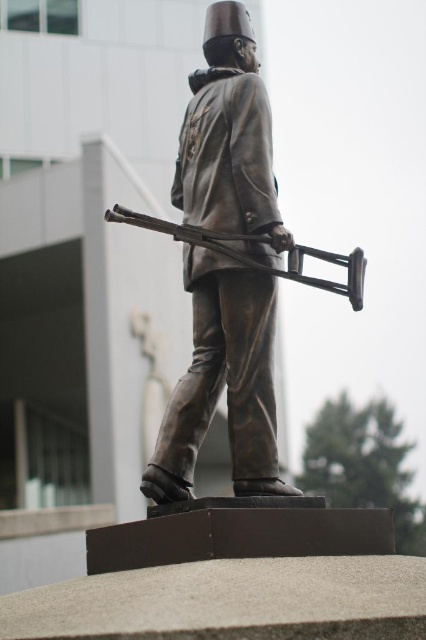
Which is below, bronze statue at center or bronze rifle at center?

bronze rifle at center is below.

The width and height of the screenshot is (426, 640). Find the location of `bronze statue at center`. bronze statue at center is located at coordinates (222, 381).

Where is `bronze statue at center`? The image size is (426, 640). bronze statue at center is located at coordinates (222, 381).